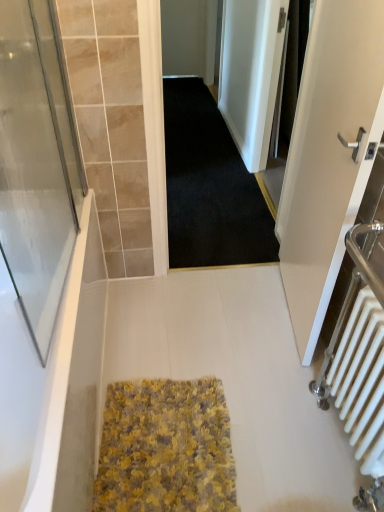
The width and height of the screenshot is (384, 512). I want to click on free location in front of white matte door at right, so click(275, 385).